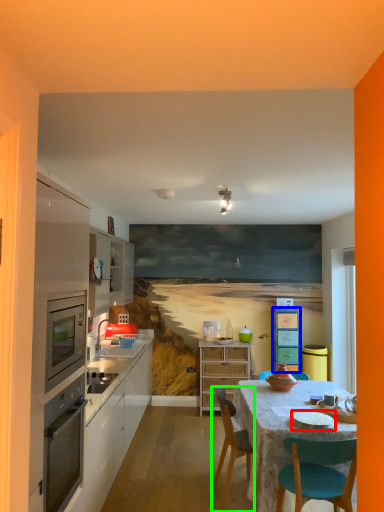
Question: Which object is positioned closest to tableware (highlighted by a red box)? Select from cabinetry (highlighted by a blue box) and chair (highlighted by a green box).

Choices:
 (A) cabinetry
 (B) chair

Answer: (B)